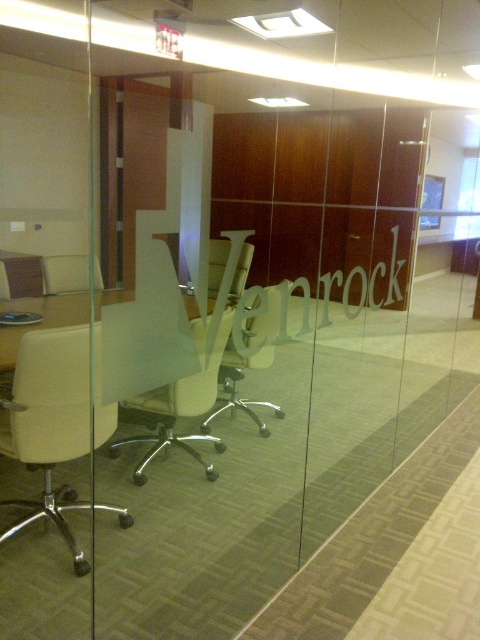
Looking at this image, does white leather swivel chair at left appear under matte white office chair at center?

Indeed, white leather swivel chair at left is positioned under matte white office chair at center.

Between white leather swivel chair at left and matte white office chair at center, which one appears on the right side from the viewer's perspective?

Positioned to the right is matte white office chair at center.

You are a GUI agent. You are given a task and a screenshot of the screen. Output one action in this format:
    pyautogui.click(x=<x>, y=<y>)
    Task: Click on the white leather swivel chair at left
    
    Given the screenshot: What is the action you would take?
    pyautogui.click(x=48, y=422)

Which is in front, point (61, 397) or point (87, 273)?

Positioned in front is point (87, 273).

Does white leather swivel chair at left appear on the left side of white plastic chair at left?

Indeed, white leather swivel chair at left is positioned on the left side of white plastic chair at left.

Between point (69, 380) and point (74, 285), which one is positioned behind?

Positioned behind is point (74, 285).

I want to click on white leather swivel chair at left, so click(48, 422).

In the scene shown: Does white plastic swivel chair at center appear on the right side of white plastic chair at left?

Correct, you'll find white plastic swivel chair at center to the right of white plastic chair at left.

Can you confirm if white plastic swivel chair at center is positioned to the left of white plastic chair at left?

No, white plastic swivel chair at center is not to the left of white plastic chair at left.

Does point (200, 323) come in front of point (48, 272)?

No, it is not.

Identify the location of white plastic swivel chair at center. This screenshot has height=640, width=480. (180, 408).